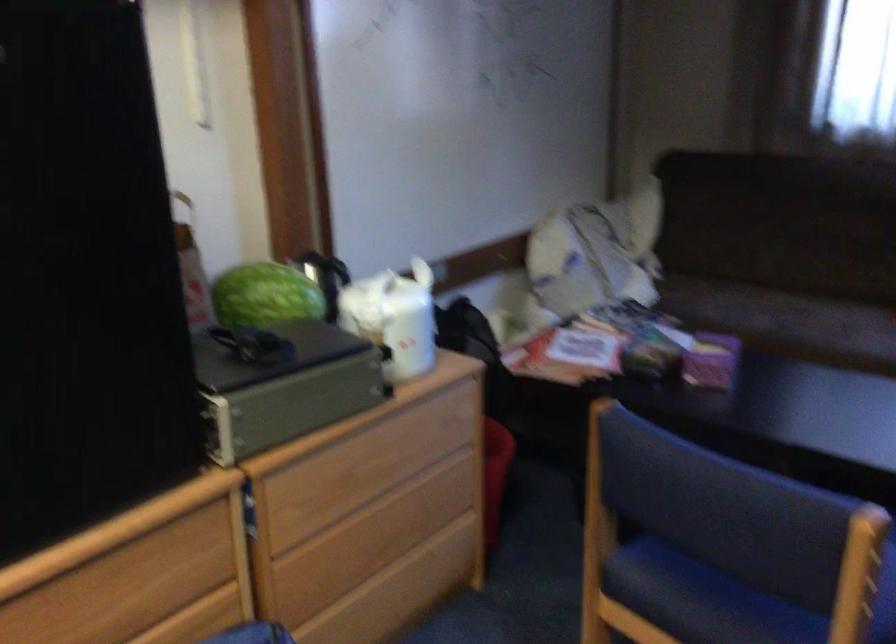
The width and height of the screenshot is (896, 644). What do you see at coordinates (787, 322) in the screenshot?
I see `the sofa sitting surface` at bounding box center [787, 322].